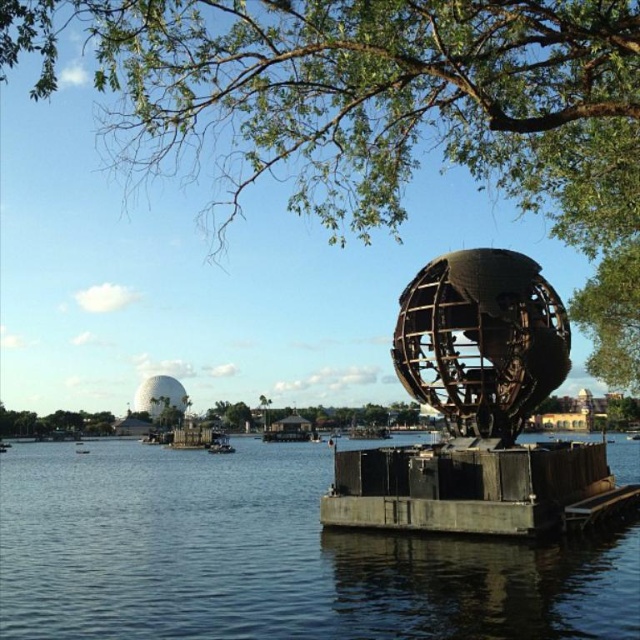
Consider the image. Which is more to the right, green leafy tree at upper center or dark blue water at center?

From the viewer's perspective, dark blue water at center appears more on the right side.

Is green leafy tree at upper center above dark blue water at center?

Correct, green leafy tree at upper center is located above dark blue water at center.

Image resolution: width=640 pixels, height=640 pixels. What do you see at coordinates (312, 172) in the screenshot?
I see `green leafy tree at upper center` at bounding box center [312, 172].

Where is `green leafy tree at upper center`? green leafy tree at upper center is located at coordinates (312, 172).

Who is shorter, green leafy tree at upper center or rustic wood dock at lower right?

With less height is rustic wood dock at lower right.

Does point (198, 32) come behind point (584, 461)?

That is False.

In order to click on green leafy tree at upper center in this screenshot , I will do `click(312, 172)`.

How far apart are dark blue water at center and rustic wood dock at lower right?

The distance of dark blue water at center from rustic wood dock at lower right is 9.11 meters.

Is dark blue water at center taller than rustic wood dock at lower right?

Yes, dark blue water at center is taller than rustic wood dock at lower right.

Does point (225, 524) lie in front of point (388, 529)?

No, it is not.

Locate an element on the screen. dark blue water at center is located at coordinates (269, 557).